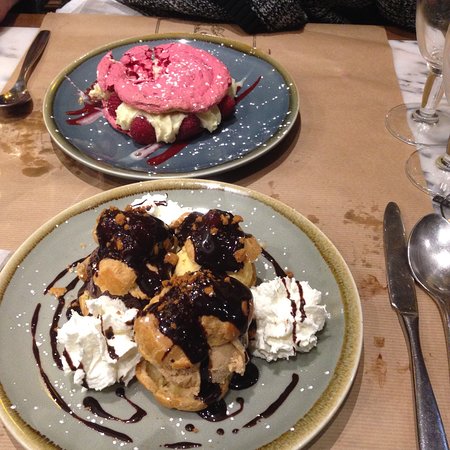
Find the location of a particular element. The height and width of the screenshot is (450, 450). table cloth is located at coordinates (359, 81).